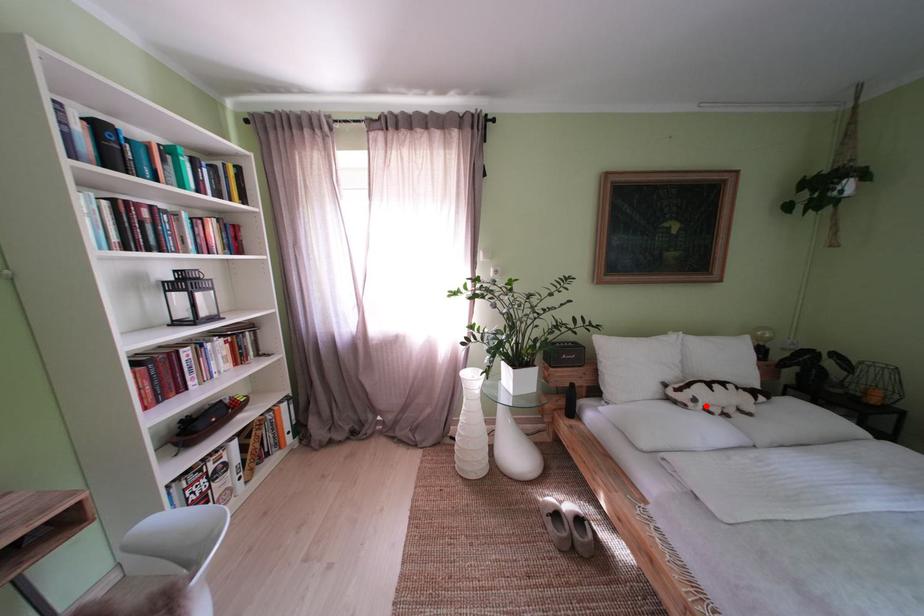
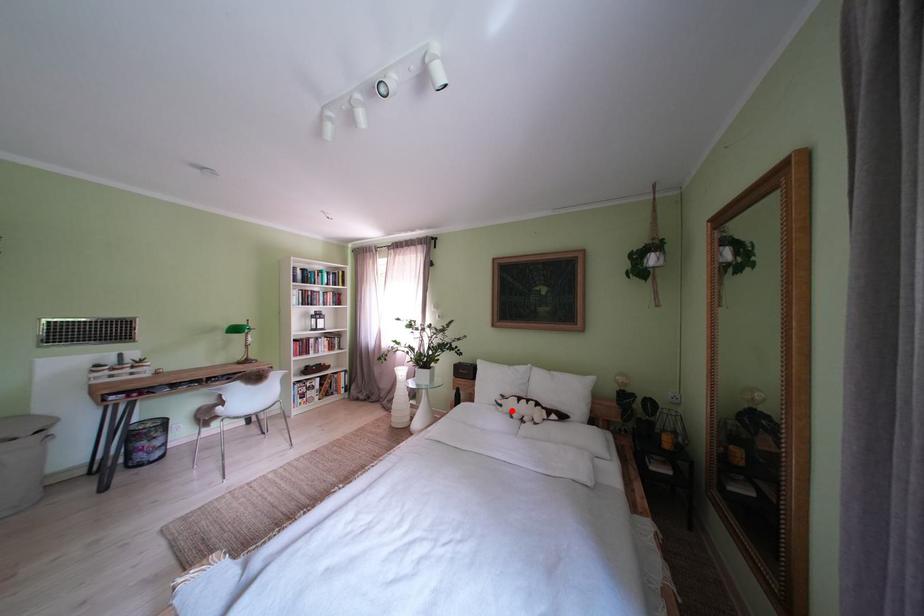
I am providing you with two images of the same scene from different viewpoints. A red point is marked on the first image and another point is marked on the second image. Do the highlighted points in image1 and image2 indicate the same real-world spot?

Yes